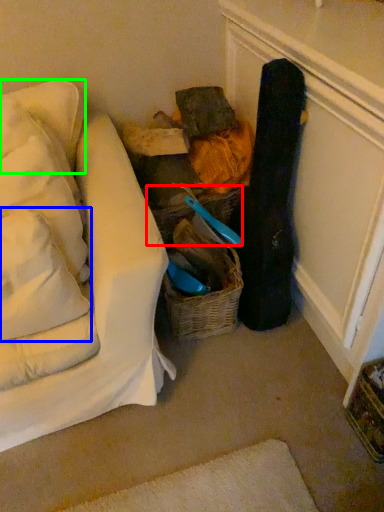
Question: Estimate the real-world distances between objects in this image. Which object is farther from basket (highlighted by a red box), pillow (highlighted by a blue box) or pillow (highlighted by a green box)?

Choices:
 (A) pillow
 (B) pillow

Answer: (A)